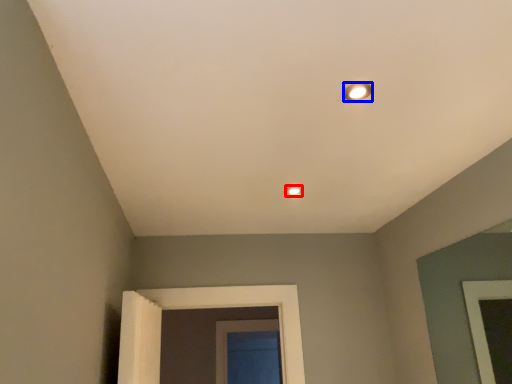
Question: Which of the following is the farthest to the observer, lamp (highlighted by a red box) or light (highlighted by a blue box)?

Choices:
 (A) lamp
 (B) light

Answer: (A)